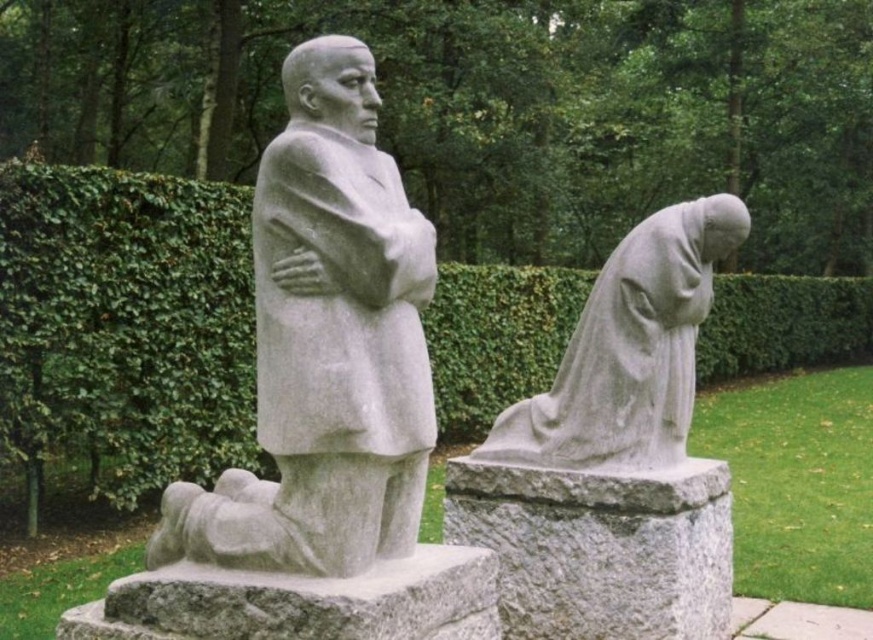
Question: Among these objects, which one is nearest to the camera?

Choices:
 (A) gray stone statue at lower right
 (B) white stone statue at center

Answer: (B)

Question: Is white stone statue at center to the right of gray stone statue at lower right from the viewer's perspective?

Choices:
 (A) no
 (B) yes

Answer: (A)

Question: Which point is farther from the camera taking this photo?

Choices:
 (A) (601, 282)
 (B) (277, 358)

Answer: (A)

Question: Does white stone statue at center have a larger size compared to gray stone statue at lower right?

Choices:
 (A) yes
 (B) no

Answer: (A)

Question: Which point appears farthest from the camera in this image?

Choices:
 (A) (655, 275)
 (B) (399, 193)

Answer: (A)

Question: Is white stone statue at center below gray stone statue at lower right?

Choices:
 (A) yes
 (B) no

Answer: (B)